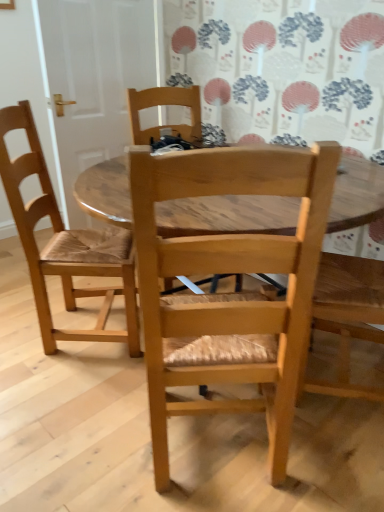
Question: Would you say light brown wood chair at left, which is counted as the 2th chair, starting from the right, is a long distance from light wood/marble chair at center, which ranks as the first chair in right-to-left order?

Choices:
 (A) yes
 (B) no

Answer: (B)

Question: Does light brown wood chair at left, arranged as the first chair when viewed from the left, have a larger size compared to light wood/marble chair at center, which ranks as the first chair in right-to-left order?

Choices:
 (A) no
 (B) yes

Answer: (A)

Question: From the image's perspective, does light brown wood chair at left, arranged as the first chair when viewed from the left, appear lower than light wood/marble chair at center, the 2th chair viewed from the left?

Choices:
 (A) no
 (B) yes

Answer: (A)

Question: From the image's perspective, is light brown wood chair at left, which is counted as the 2th chair, starting from the right, on top of light wood/marble chair at center, the 2th chair viewed from the left?

Choices:
 (A) no
 (B) yes

Answer: (B)

Question: Can you confirm if light brown wood chair at left, arranged as the first chair when viewed from the left, is taller than light wood/marble chair at center, the 2th chair viewed from the left?

Choices:
 (A) no
 (B) yes

Answer: (A)

Question: Is light wood/marble chair at center, which ranks as the first chair in right-to-left order, at the back of light brown wood chair at left, which is counted as the 2th chair, starting from the right?

Choices:
 (A) yes
 (B) no

Answer: (B)

Question: Is light wood/marble chair at center, the 2th chair viewed from the left, positioned with its back to light brown wood chair at left, arranged as the first chair when viewed from the left?

Choices:
 (A) yes
 (B) no

Answer: (B)

Question: Is light wood/marble chair at center, the 2th chair viewed from the left, not within light brown wood chair at left, arranged as the first chair when viewed from the left?

Choices:
 (A) yes
 (B) no

Answer: (A)

Question: Is light wood/marble chair at center, which ranks as the first chair in right-to-left order, behind light brown wood chair at left, arranged as the first chair when viewed from the left?

Choices:
 (A) no
 (B) yes

Answer: (A)

Question: Is light wood/marble chair at center, the 2th chair viewed from the left, at the left side of light brown wood chair at left, which is counted as the 2th chair, starting from the right?

Choices:
 (A) yes
 (B) no

Answer: (B)

Question: Is light wood/marble chair at center, the 2th chair viewed from the left, far away from light brown wood chair at left, arranged as the first chair when viewed from the left?

Choices:
 (A) yes
 (B) no

Answer: (B)

Question: Is light wood/marble chair at center, the 2th chair viewed from the left, placed right next to light brown wood chair at left, which is counted as the 2th chair, starting from the right?

Choices:
 (A) yes
 (B) no

Answer: (B)

Question: Considering their positions, is light wood/marble chair at center, the 2th chair viewed from the left, located in front of or behind light brown wood chair at left, which is counted as the 2th chair, starting from the right?

Choices:
 (A) behind
 (B) front

Answer: (B)